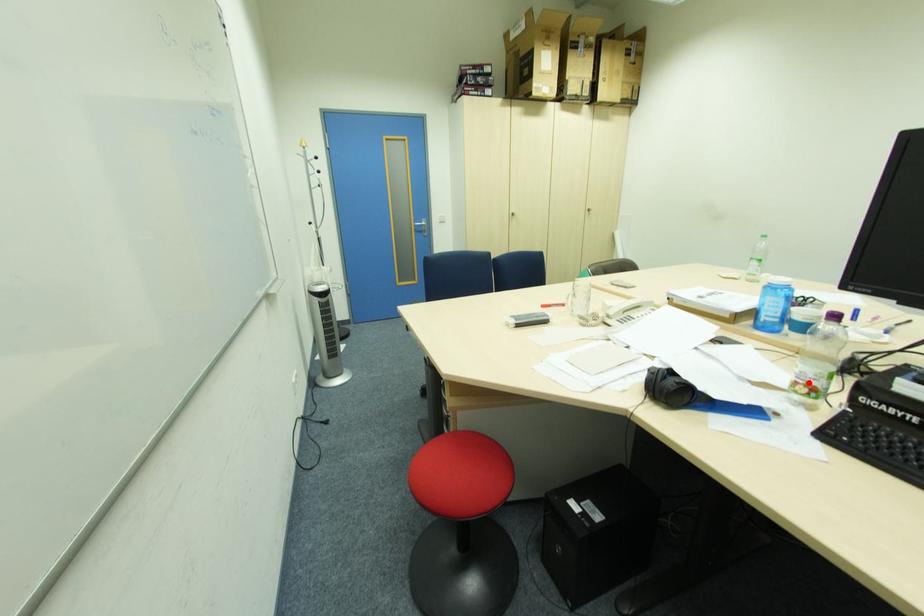
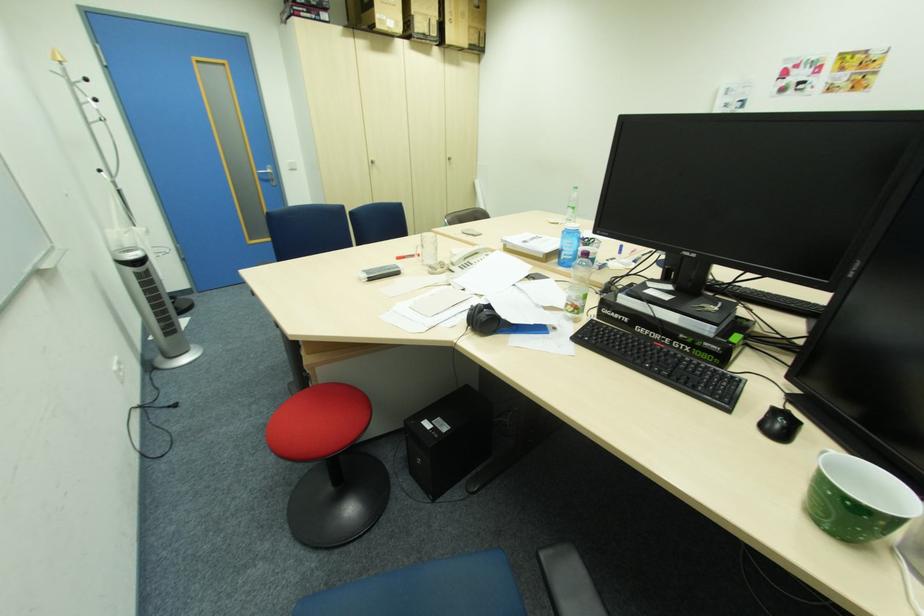
Question: I am providing you with two images of the same scene from different viewpoints. A red point is marked on the first image. Is the red point's position out of view in image 2?

Choices:
 (A) Yes
 (B) No

Answer: (B)